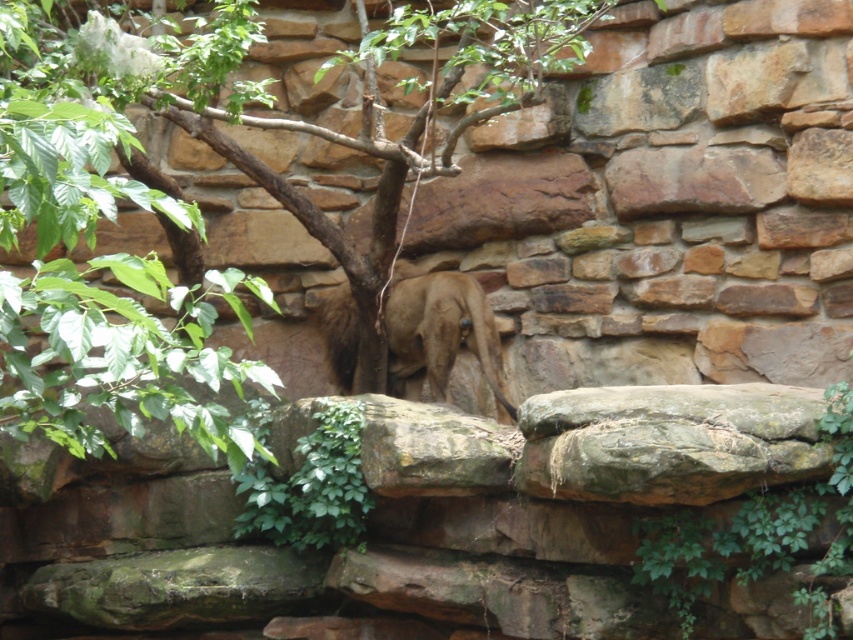
You are standing in the enclosure and looking at the two points marked in the image. Which point, point (32,144) or point (439,380), is nearer to you?

Point (32,144) is closer to the viewer than point (439,380), so it is the nearer one.

From the picture: You are a zookeeper observing the enclosure. You notice the green leafy tree at center and the brown fur at center. Which object is positioned to the right side of the other?

The brown fur at center is positioned to the right of the green leafy tree at center.

You are a zookeeper who needs to place a new sign on the enclosure. The sign must be placed at a height that is above the brown fur at center but below the green leafy tree at center. Is this possible?

The green leafy tree at center is taller than the brown fur at center, so yes, the sign can be placed between their heights.